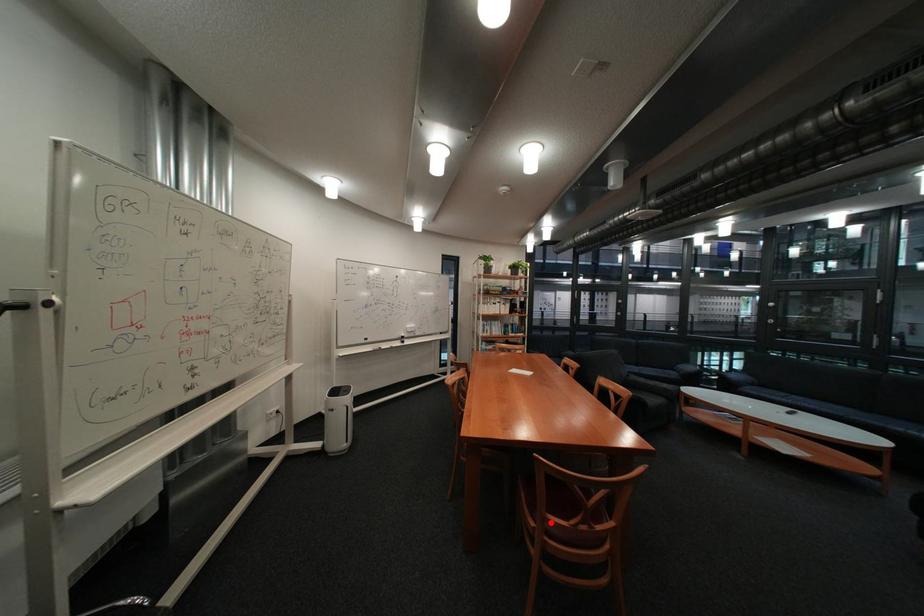
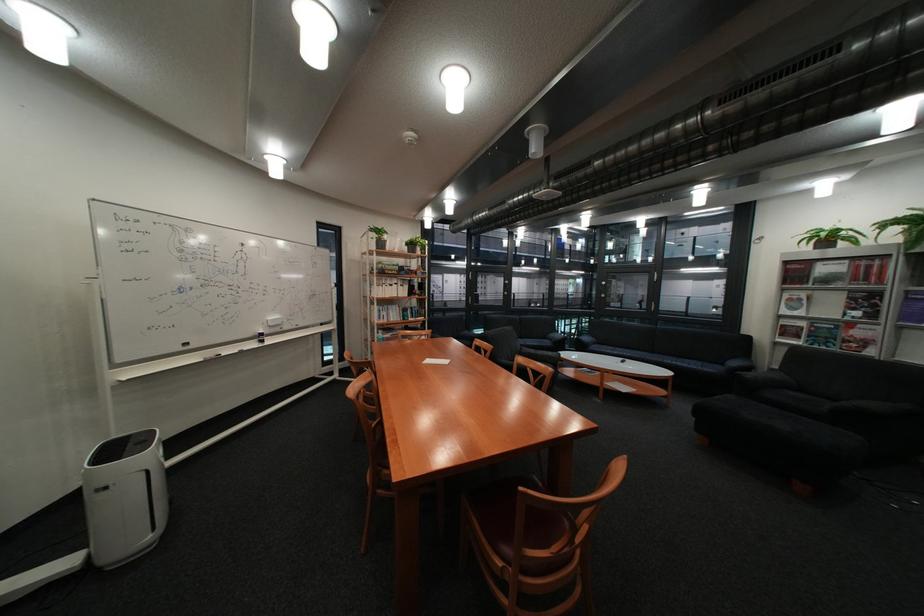
In the second image, find the point that corresponds to the highlighted location in the first image.

(526, 567)